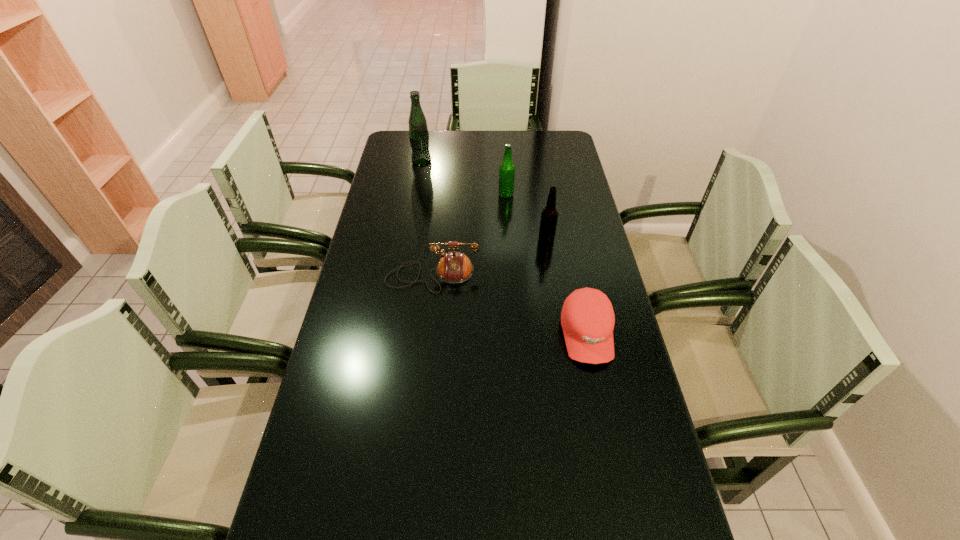
Where is `vacant point located between the telephone and the cap`? The height and width of the screenshot is (540, 960). vacant point located between the telephone and the cap is located at coordinates (510, 305).

Locate an element on the screen. The height and width of the screenshot is (540, 960). free spot between the nearest object and the second farthest beer bottle is located at coordinates (546, 265).

I want to click on vacant point located between the second farthest beer bottle and the cap, so click(546, 265).

The height and width of the screenshot is (540, 960). I want to click on the third closest object to the cap, so click(507, 169).

Identify which object is the second closest to the tallest beer bottle. Please provide its 2D coordinates. Your answer should be formatted as a tuple, i.e. [(x, y)], where the tuple contains the x and y coordinates of a point satisfying the conditions above.

[(454, 267)]

Choose which beer bottle is the second nearest neighbor to the third object from left to right. Please provide its 2D coordinates. Your answer should be formatted as a tuple, i.e. [(x, y)], where the tuple contains the x and y coordinates of a point satisfying the conditions above.

[(418, 131)]

Identify the location of the closest beer bottle relative to the nearest object. pyautogui.click(x=549, y=215).